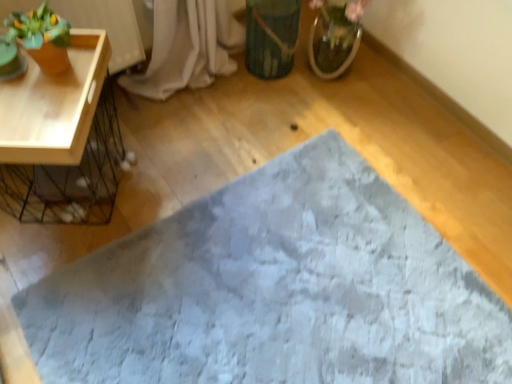
Where is `free spot in front of matte orange pot at upper left`? The image size is (512, 384). free spot in front of matte orange pot at upper left is located at coordinates (41, 117).